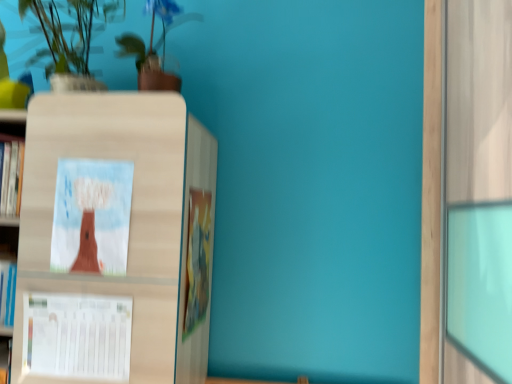
Question: Is green matte plant at upper center, which is counted as the 1th houseplant, starting from the right, oriented away from white paper calendar at lower left, marked as the second book cover in a top-to-bottom arrangement?

Choices:
 (A) no
 (B) yes

Answer: (A)

Question: From the image's perspective, is green matte plant at upper center, arranged as the second houseplant when viewed from the left, on white paper calendar at lower left, marked as the second book cover in a top-to-bottom arrangement?

Choices:
 (A) no
 (B) yes

Answer: (B)

Question: Is green matte plant at upper center, arranged as the second houseplant when viewed from the left, not within white paper calendar at lower left, marked as the 1th book cover in a bottom-to-top arrangement?

Choices:
 (A) yes
 (B) no

Answer: (A)

Question: Can you confirm if green matte plant at upper center, arranged as the second houseplant when viewed from the left, is positioned to the left of white paper calendar at lower left, marked as the 1th book cover in a bottom-to-top arrangement?

Choices:
 (A) yes
 (B) no

Answer: (B)

Question: Is green matte plant at upper center, which is counted as the 1th houseplant, starting from the right, not near white paper calendar at lower left, marked as the 1th book cover in a bottom-to-top arrangement?

Choices:
 (A) no
 (B) yes

Answer: (A)

Question: Choose the correct answer: Is green matte plant at upper left, which is counted as the second houseplant, starting from the right, inside hardcover book at center or outside it?

Choices:
 (A) outside
 (B) inside

Answer: (A)

Question: Would you say green matte plant at upper left, which is counted as the second houseplant, starting from the right, is to the left or to the right of hardcover book at center in the picture?

Choices:
 (A) left
 (B) right

Answer: (A)

Question: Based on their sizes in the image, would you say green matte plant at upper left, the 1th houseplant when ordered from left to right, is bigger or smaller than hardcover book at center?

Choices:
 (A) small
 (B) big

Answer: (B)

Question: From the image's perspective, is green matte plant at upper left, the 1th houseplant when ordered from left to right, above or below hardcover book at center?

Choices:
 (A) below
 (B) above

Answer: (B)

Question: In terms of size, does matte paper tree at center, arranged as the first book cover when viewed from the top, appear bigger or smaller than green matte plant at upper left, the 1th houseplant when ordered from left to right?

Choices:
 (A) small
 (B) big

Answer: (A)

Question: Relative to green matte plant at upper left, the 1th houseplant when ordered from left to right, is matte paper tree at center, arranged as the first book cover when viewed from the top, in front or behind?

Choices:
 (A) front
 (B) behind

Answer: (B)

Question: Is point (65, 246) positioned closer to the camera than point (54, 69)?

Choices:
 (A) closer
 (B) farther

Answer: (A)

Question: In terms of width, does matte paper tree at center, acting as the second book cover starting from the bottom, look wider or thinner when compared to green matte plant at upper left, the 1th houseplant when ordered from left to right?

Choices:
 (A) wide
 (B) thin

Answer: (B)

Question: Is point (97, 271) closer or farther from the camera than point (206, 264)?

Choices:
 (A) closer
 (B) farther

Answer: (A)

Question: From the image's perspective, is matte paper tree at center, arranged as the first book cover when viewed from the top, above or below hardcover book at center?

Choices:
 (A) above
 (B) below

Answer: (A)